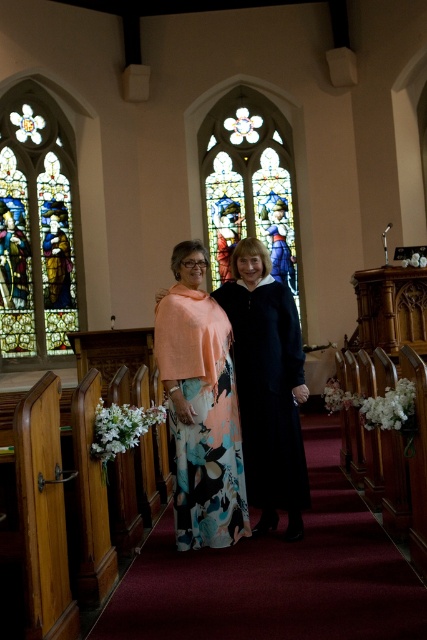
Based on the photo, you are standing at the entrance of the church and want to take a photo of the two points marked in the image. Which point, point (x=8, y=109) or point (x=205, y=150), will appear larger in your photo?

Point (x=8, y=109) is closer to the camera than point (x=205, y=150), so it will appear larger in the photo.

You are standing at the entrance of the church facing the central aisle. There is a stained glass window marked at point (38, 228). If you want to walk towards the stained glass window at left, which direction should you move relative to the central aisle?

The point (38, 228) indicates the stained glass window at left, so you should move towards the left side of the central aisle to reach it.